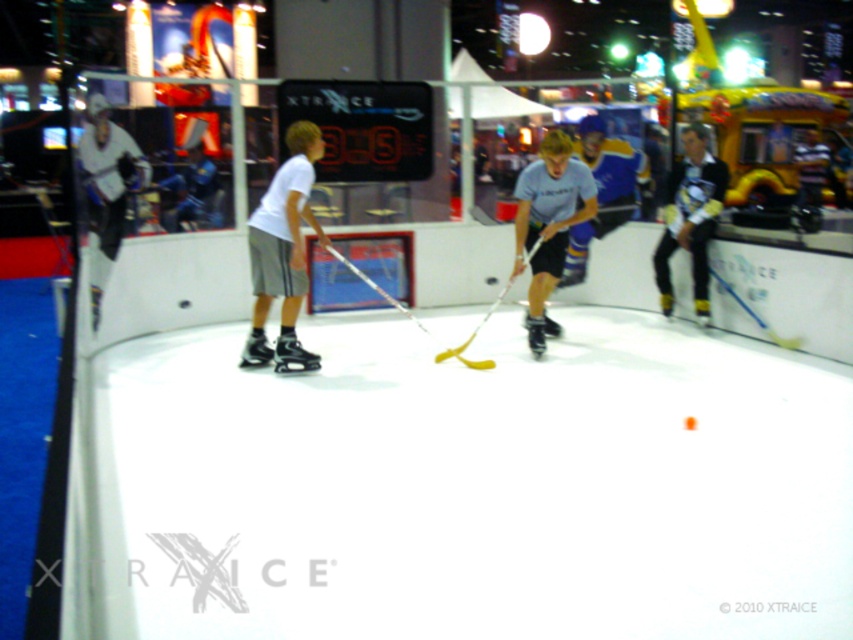
Question: Which point is closer to the camera taking this photo?

Choices:
 (A) (741, 304)
 (B) (686, 192)
 (C) (521, 232)
 (D) (286, 138)

Answer: (D)

Question: Where is light blue jersey at center located in relation to matte blue hockey stick at center in the image?

Choices:
 (A) left
 (B) right

Answer: (A)

Question: Where is matte black hockey stick at right located in relation to matte blue hockey stick at center in the image?

Choices:
 (A) left
 (B) right

Answer: (A)

Question: Among these objects, which one is farthest from the camera?

Choices:
 (A) matte blue hockey stick at center
 (B) matte black hockey stick at right

Answer: (B)

Question: Which point appears farthest from the camera in this image?

Choices:
 (A) (705, 225)
 (B) (288, 323)
 (C) (703, 129)
 (D) (544, 177)

Answer: (C)

Question: Does light blue jersey at center come behind matte black hockey stick at right?

Choices:
 (A) no
 (B) yes

Answer: (A)